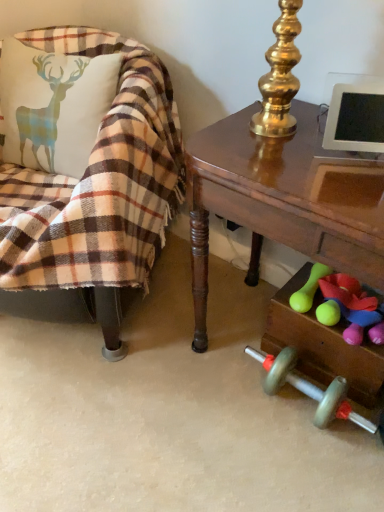
Question: Would you say plaid fabric chair at left contains green rubber dumbbell at lower right, the 1th toy in the left-to-right sequence?

Choices:
 (A) yes
 (B) no

Answer: (B)

Question: Is plaid fabric chair at left at the right side of green rubber dumbbell at lower right, the 2th toy in the right-to-left sequence?

Choices:
 (A) yes
 (B) no

Answer: (B)

Question: Is plaid fabric chair at left closer to camera compared to green rubber dumbbell at lower right, the 1th toy in the left-to-right sequence?

Choices:
 (A) yes
 (B) no

Answer: (A)

Question: Is plaid fabric chair at left oriented away from green rubber dumbbell at lower right, the 1th toy in the left-to-right sequence?

Choices:
 (A) no
 (B) yes

Answer: (A)

Question: From a real-world perspective, is plaid fabric chair at left over green rubber dumbbell at lower right, the 1th toy in the left-to-right sequence?

Choices:
 (A) yes
 (B) no

Answer: (A)

Question: Considering the relative sizes of plaid fabric chair at left and green rubber dumbbell at lower right, the 1th toy in the left-to-right sequence, in the image provided, is plaid fabric chair at left smaller than green rubber dumbbell at lower right, the 1th toy in the left-to-right sequence,?

Choices:
 (A) no
 (B) yes

Answer: (A)

Question: Is shiny brown desk at right oriented away from plaid fabric chair at left?

Choices:
 (A) yes
 (B) no

Answer: (B)

Question: Can you see shiny brown desk at right touching plaid fabric chair at left?

Choices:
 (A) yes
 (B) no

Answer: (B)

Question: Considering the relative positions of shiny brown desk at right and plaid fabric chair at left in the image provided, is shiny brown desk at right to the right of plaid fabric chair at left from the viewer's perspective?

Choices:
 (A) yes
 (B) no

Answer: (A)

Question: Does shiny brown desk at right appear on the left side of plaid fabric chair at left?

Choices:
 (A) yes
 (B) no

Answer: (B)

Question: Does shiny brown desk at right have a greater width compared to plaid fabric chair at left?

Choices:
 (A) yes
 (B) no

Answer: (B)

Question: Is shiny brown desk at right taller than plaid fabric chair at left?

Choices:
 (A) yes
 (B) no

Answer: (B)

Question: From the image's perspective, is rubberized green dumbbell at lower right, acting as the first toy starting from the right, on plaid fabric chair at left?

Choices:
 (A) no
 (B) yes

Answer: (A)